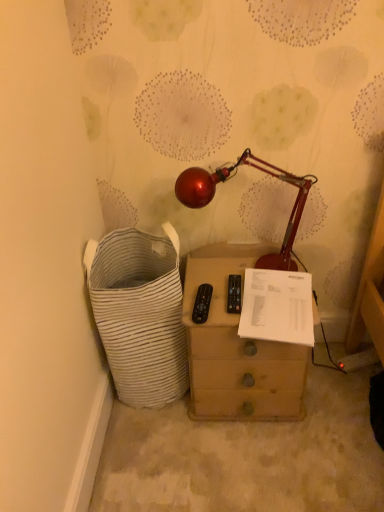
Locate an element on the screen. The height and width of the screenshot is (512, 384). free point below shiny metallic lamp at center (from a real-world perspective) is located at coordinates (233, 271).